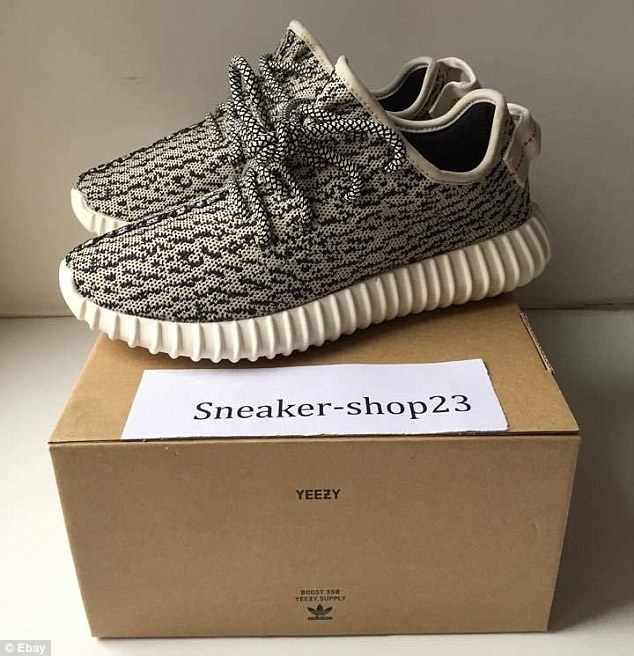
Find the location of a particular element. This screenshot has width=634, height=656. grey wall is located at coordinates (87, 54), (553, 79).